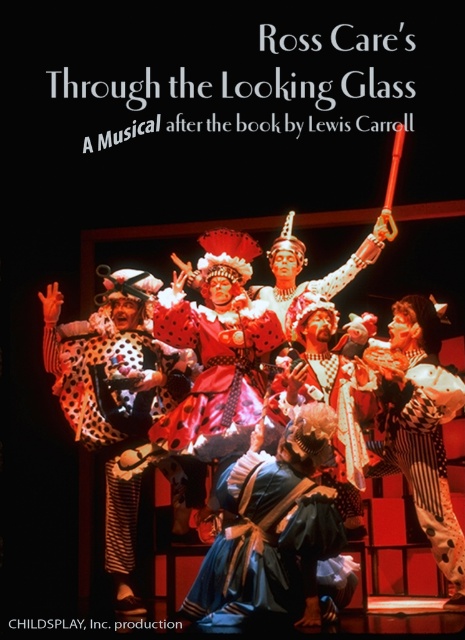
Question: Observing the image, what is the correct spatial positioning of blue satin dress at center in reference to white polka dot fabric at center?

Choices:
 (A) below
 (B) above

Answer: (A)

Question: Does blue satin dress at center appear on the right side of velvet red dress at center?

Choices:
 (A) no
 (B) yes

Answer: (A)

Question: Which object is farther from the camera taking this photo?

Choices:
 (A) white polka dot fabric at center
 (B) red polka dot fabric dress at center

Answer: (B)

Question: From the image, what is the correct spatial relationship of spotted fabric clown at center in relation to red polka dot fabric dress at center?

Choices:
 (A) right
 (B) left

Answer: (B)

Question: Considering the real-world distances, which object is closest to the velvet red dress at center?

Choices:
 (A) blue satin dress at center
 (B) spotted fabric clown at center
 (C) white polka dot fabric at center
 (D) red polka dot fabric dress at center

Answer: (C)

Question: Estimate the real-world distances between objects in this image. Which object is farther from the velvet red dress at center?

Choices:
 (A) white polka dot fabric at center
 (B) spotted fabric clown at center
 (C) blue satin dress at center
 (D) red polka dot fabric dress at center

Answer: (B)